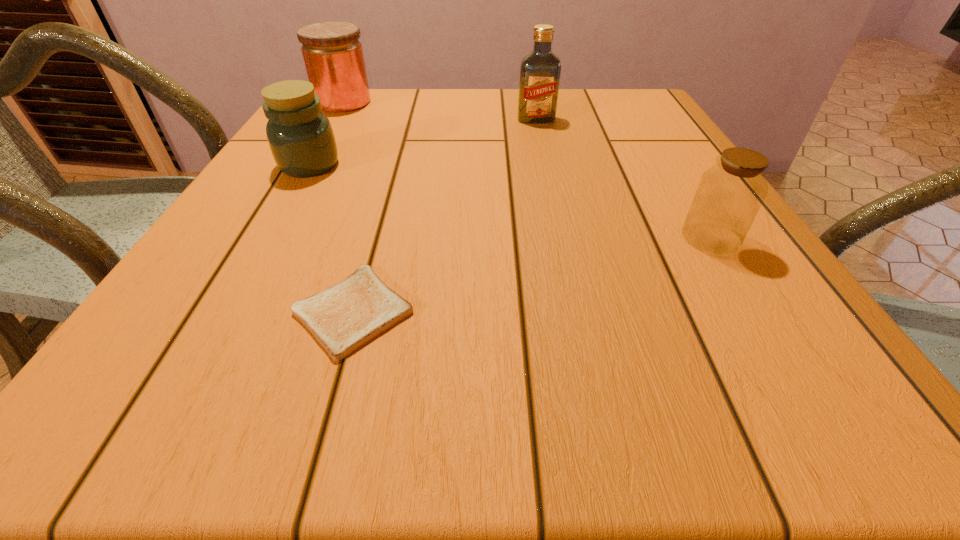
I want to click on vacant space at the left edge of the desktop, so click(259, 256).

This screenshot has width=960, height=540. I want to click on vacant space at the right edge of the desktop, so click(x=685, y=221).

Image resolution: width=960 pixels, height=540 pixels. I want to click on blank space at the far right corner of the desktop, so click(639, 120).

Locate an element on the screen. The width and height of the screenshot is (960, 540). vacant region between the vodka and the rightmost jar is located at coordinates (623, 179).

Where is `vacant area that lies between the nearest object and the second nearest jar`? The image size is (960, 540). vacant area that lies between the nearest object and the second nearest jar is located at coordinates (331, 238).

Where is `free spot between the toast and the second nearest jar`? Image resolution: width=960 pixels, height=540 pixels. free spot between the toast and the second nearest jar is located at coordinates (331, 238).

At what (x,y) coordinates should I click in order to perform the action: click on free space between the farthest jar and the vodka. Please return your answer as a coordinate pair (x, y). Image resolution: width=960 pixels, height=540 pixels. Looking at the image, I should click on (440, 111).

The image size is (960, 540). What are the coordinates of `unoccupied area between the second nearest jar and the rightmost jar` in the screenshot? It's located at (510, 201).

This screenshot has width=960, height=540. What are the coordinates of `free point between the second object from right to left and the toast` in the screenshot? It's located at [444, 215].

Locate an element on the screen. Image resolution: width=960 pixels, height=540 pixels. free space between the second nearest jar and the rightmost jar is located at coordinates (510, 201).